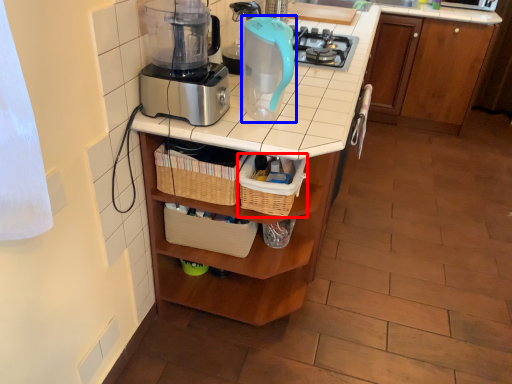
Question: Which of the following is the closest to the observer, basket (highlighted by a red box) or kitchen appliance (highlighted by a blue box)?

Choices:
 (A) basket
 (B) kitchen appliance

Answer: (B)